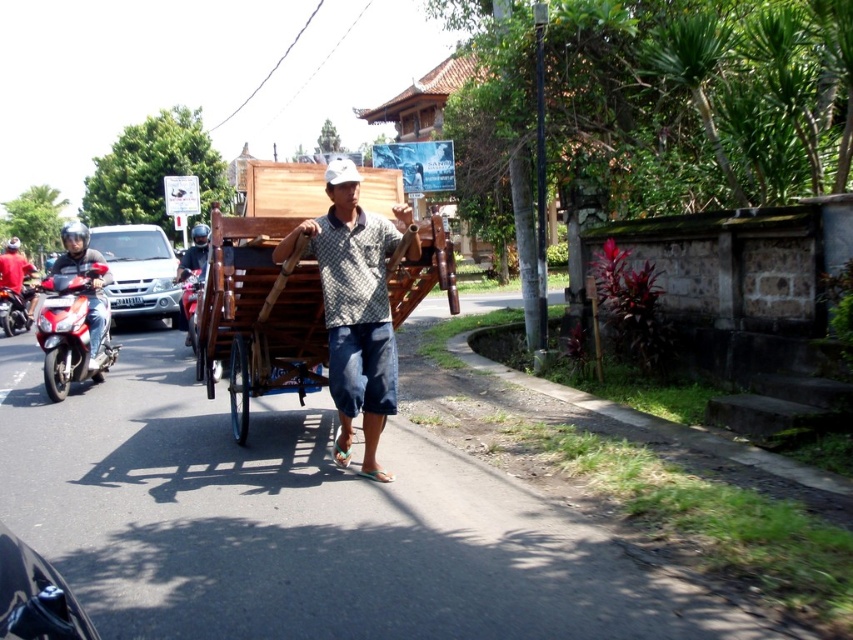
Question: Does wooden cart at center have a smaller size compared to shiny red motorcycle at left?

Choices:
 (A) no
 (B) yes

Answer: (A)

Question: Is printed cotton shirt at center to the right of shiny red motorcycle at left from the viewer's perspective?

Choices:
 (A) no
 (B) yes

Answer: (B)

Question: Among these objects, which one is farthest from the camera?

Choices:
 (A) matte black helmet at left
 (B) matte black motorcycle at left
 (C) wooden cart at center
 (D) silver metallic car at left

Answer: (B)

Question: Which of the following is the farthest from the observer?

Choices:
 (A) printed cotton shirt at center
 (B) silver metallic car at left

Answer: (B)

Question: Considering the relative positions of printed cotton shirt at center and matte black helmet at left in the image provided, where is printed cotton shirt at center located with respect to matte black helmet at left?

Choices:
 (A) right
 (B) left

Answer: (A)

Question: Which object appears closest to the camera in this image?

Choices:
 (A) red glossy motorcycle at left
 (B) shiny red motorcycle at left
 (C) printed cotton shirt at center

Answer: (C)